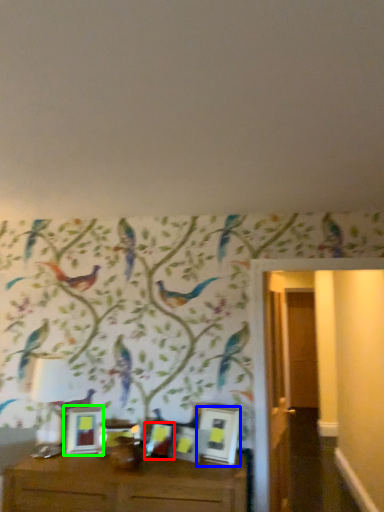
Question: Based on their relative distances, which object is nearer to picture frame (highlighted by a red box)? Choose from picture frame (highlighted by a blue box) and picture frame (highlighted by a green box).

Choices:
 (A) picture frame
 (B) picture frame

Answer: (A)